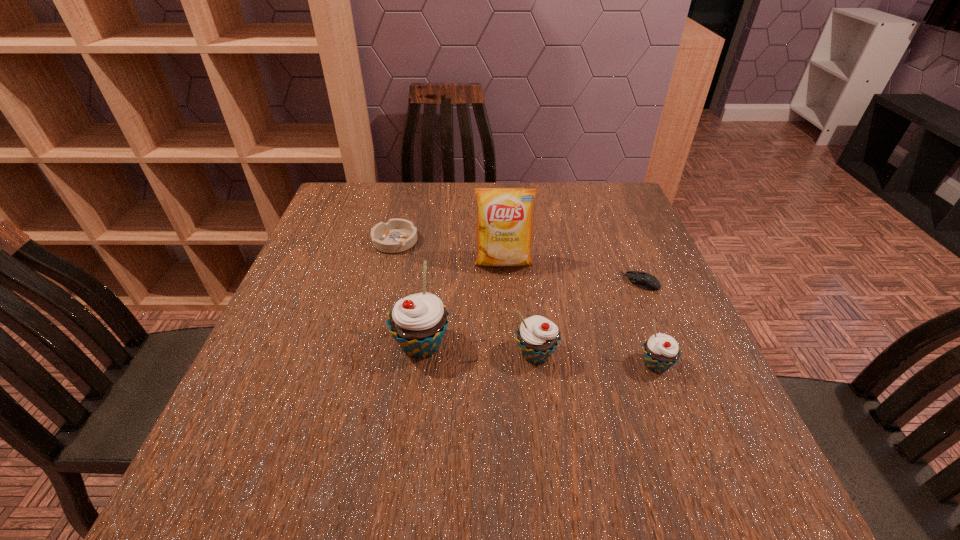
Given the evenly spaced cupcakes in the image, where should an extra cupcake be added on the left to preserve the spacing? Please point to a vacant space. Please provide its 2D coordinates. Your answer should be formatted as a tuple, i.e. [(x, y)], where the tuple contains the x and y coordinates of a point satisfying the conditions above.

[(310, 336)]